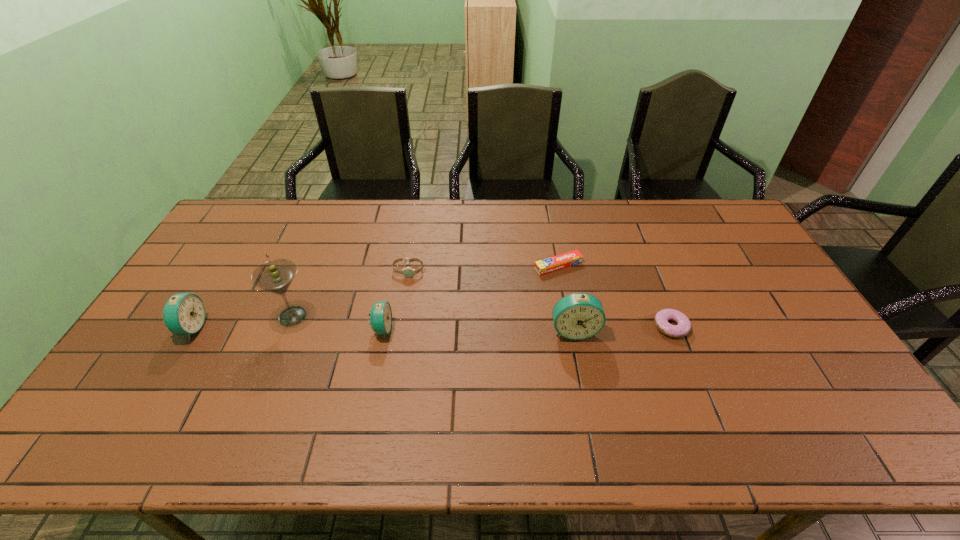
Where is `vacant space at the near edge of the desktop`? This screenshot has width=960, height=540. vacant space at the near edge of the desktop is located at coordinates (432, 379).

Find the location of a particular element. Image resolution: width=960 pixels, height=540 pixels. vacant space at the left edge of the desktop is located at coordinates (231, 252).

Locate an element on the screen. vacant space at the right edge of the desktop is located at coordinates (802, 322).

The width and height of the screenshot is (960, 540). In the image, there is a desktop. What are the coordinates of `free space at the far left corner` in the screenshot? It's located at (250, 215).

This screenshot has height=540, width=960. In order to click on vacant space at the near left corner of the desktop in this screenshot , I will do `click(143, 380)`.

Find the location of a particular element. The height and width of the screenshot is (540, 960). vacant space in between the shortest alarm clock and the rightmost object is located at coordinates (527, 328).

In order to click on vacant space in between the third shortest object and the leftmost alarm clock in this screenshot , I will do `click(300, 299)`.

At what (x,y) coordinates should I click in order to perform the action: click on vacant space that's between the leftmost alarm clock and the toothpaste. Please return your answer as a coordinate pair (x, y). Looking at the image, I should click on (374, 296).

Locate an element on the screen. The width and height of the screenshot is (960, 540). free space between the fourth shortest object and the second tallest alarm clock is located at coordinates (287, 328).

Locate an element on the screen. This screenshot has height=540, width=960. free space between the watch and the leftmost alarm clock is located at coordinates (300, 299).